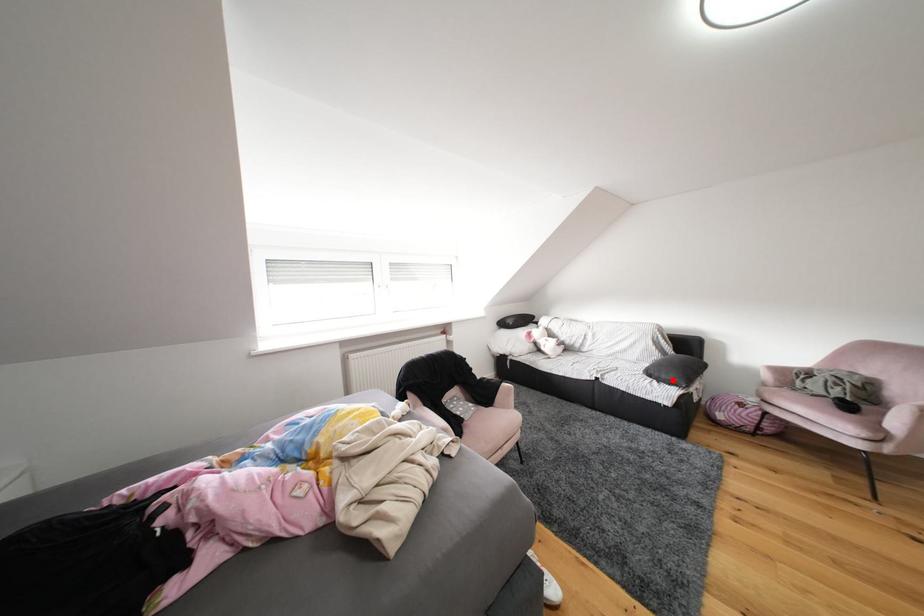
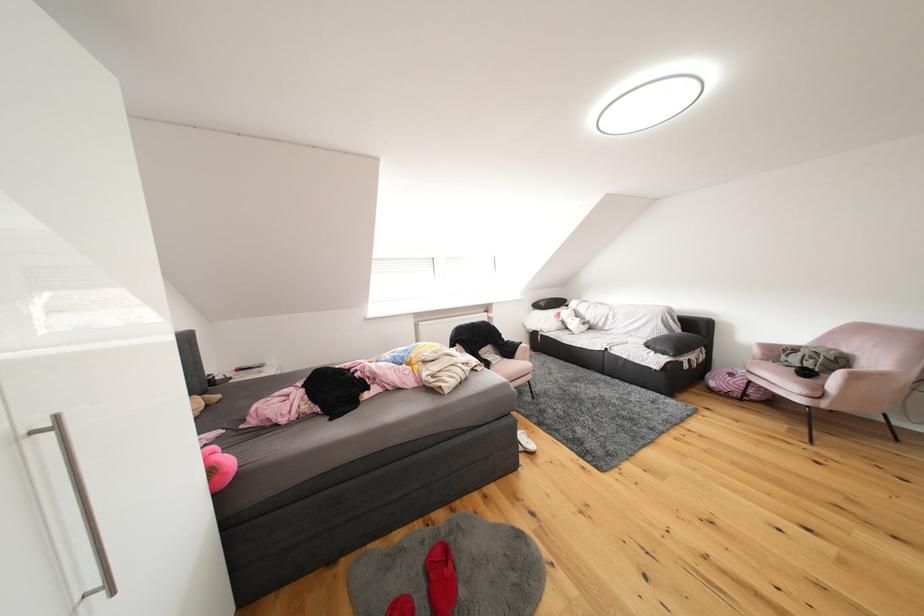
Question: I am providing you with two images of the same scene from different viewpoints. In image1, a red point is highlighted. Considering the same 3D point in image2, which of the following is correct?

Choices:
 (A) It is closer
 (B) It is farther

Answer: (A)